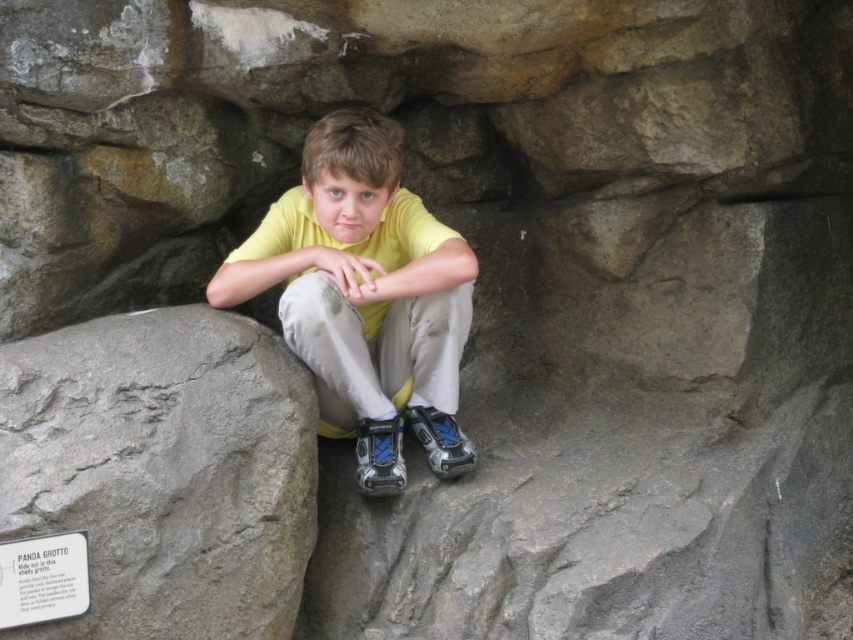
Question: Which of these objects is positioned closest to the yellow matte shirt at center?

Choices:
 (A) gray rough rock at lower left
 (B) white paper sign at lower left

Answer: (A)

Question: Which object is positioned closest to the yellow matte shirt at center?

Choices:
 (A) gray rough rock at lower left
 (B) white paper sign at lower left

Answer: (A)

Question: Is gray rough rock at lower left positioned behind yellow matte shirt at center?

Choices:
 (A) no
 (B) yes

Answer: (A)

Question: Among these objects, which one is nearest to the camera?

Choices:
 (A) yellow matte shirt at center
 (B) white paper sign at lower left
 (C) gray rough rock at lower left

Answer: (B)

Question: Is gray rough rock at lower left thinner than white paper sign at lower left?

Choices:
 (A) yes
 (B) no

Answer: (B)

Question: Does gray rough rock at lower left have a larger size compared to yellow matte shirt at center?

Choices:
 (A) yes
 (B) no

Answer: (B)